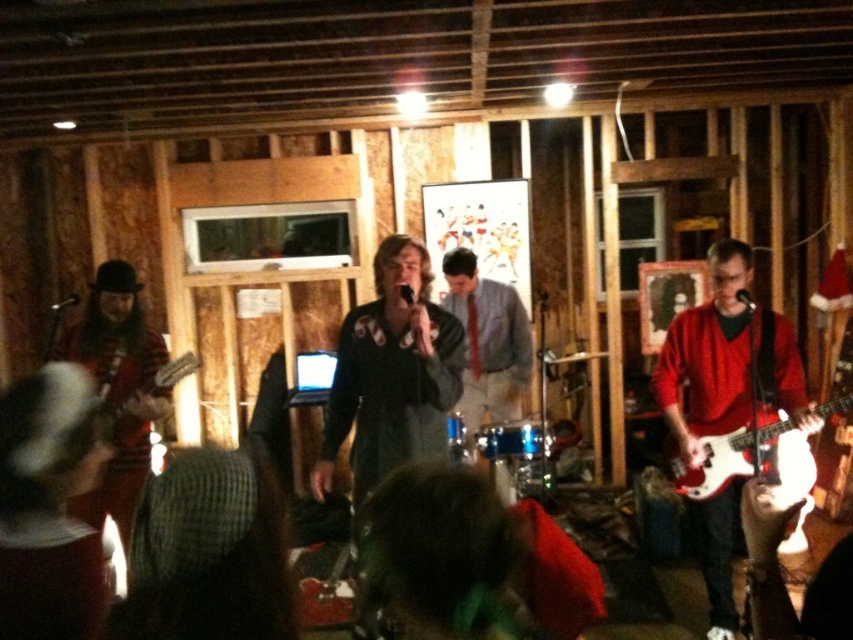
Between glossy red electric guitar at right and matte black electric guitar at left, which one has less height?

matte black electric guitar at left is shorter.

Is the position of glossy red electric guitar at right less distant than that of matte black electric guitar at left?

Yes, glossy red electric guitar at right is in front of matte black electric guitar at left.

Where is `glossy red electric guitar at right`? Image resolution: width=853 pixels, height=640 pixels. glossy red electric guitar at right is located at coordinates (747, 456).

Between blue fabric tie at center and glossy red electric guitar at right, which one appears on the right side from the viewer's perspective?

Positioned to the right is glossy red electric guitar at right.

Measure the distance between point (445, 273) and camera.

The distance of point (445, 273) from camera is 4.30 meters.

The width and height of the screenshot is (853, 640). I want to click on blue fabric tie at center, so click(486, 342).

Between red glossy electric guitar at right and glossy red electric guitar at right, which one has more height?

With more height is red glossy electric guitar at right.

Which is in front, point (734, 364) or point (747, 420)?

Point (747, 420)

Image resolution: width=853 pixels, height=640 pixels. Identify the location of red glossy electric guitar at right. (727, 358).